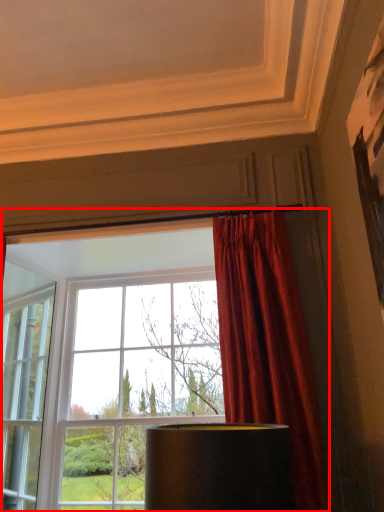
Question: From the image's perspective, where is window (annotated by the red box) located relative to curtain?

Choices:
 (A) above
 (B) below

Answer: (B)